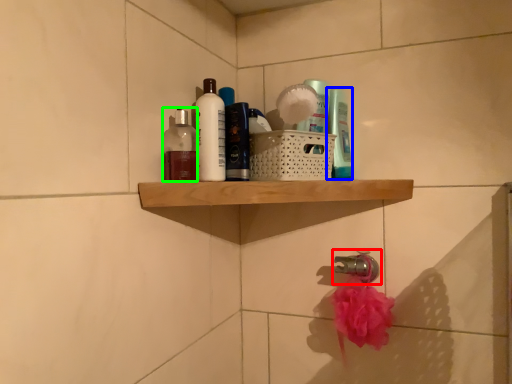
Question: Based on their relative distances, which object is farther from tap (highlighted by a red box)? Choose from toiletry (highlighted by a blue box) and toiletry (highlighted by a green box).

Choices:
 (A) toiletry
 (B) toiletry

Answer: (B)